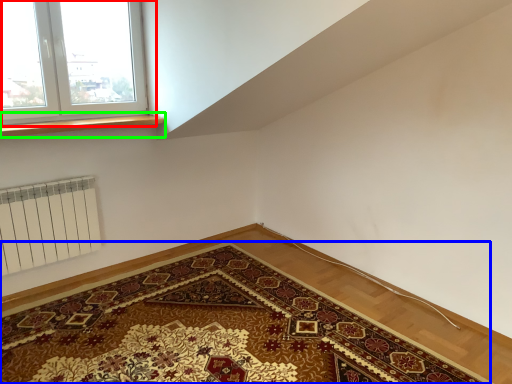
Question: Which object is the farthest from window (highlighted by a red box)? Choose among these: mat (highlighted by a blue box) or window sill (highlighted by a green box).

Choices:
 (A) mat
 (B) window sill

Answer: (A)